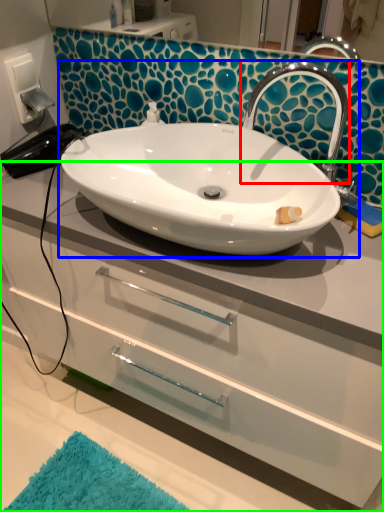
Question: Which object is the closest to the tap (highlighted by a red box)? Choose among these: sink (highlighted by a blue box) or bathroom cabinet (highlighted by a green box).

Choices:
 (A) sink
 (B) bathroom cabinet

Answer: (A)